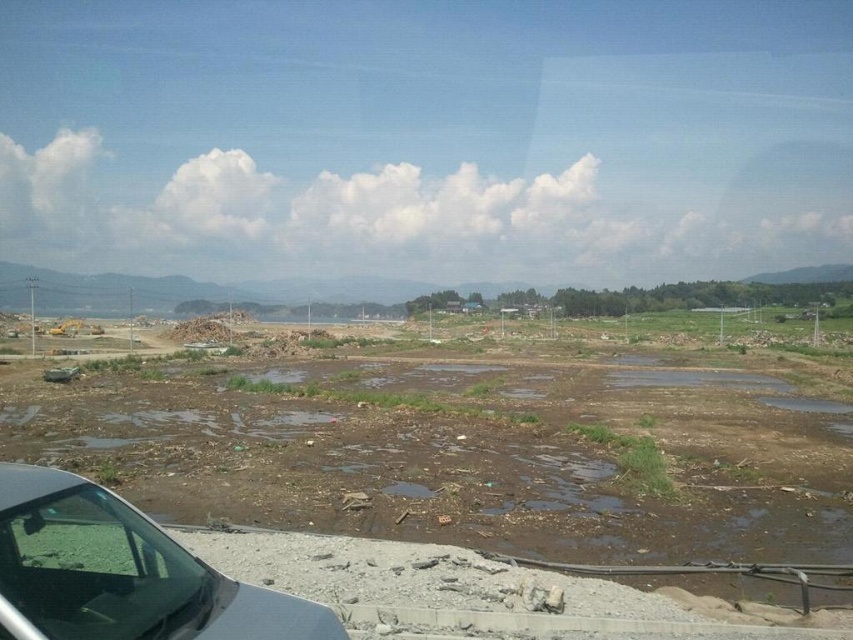
Does point (715, 460) come closer to viewer compared to point (177, 552)?

No, (715, 460) is behind (177, 552).

Is brown/dry soil at center below transparent glass car window at lower left?

Correct, brown/dry soil at center is located below transparent glass car window at lower left.

Describe the element at coordinates (451, 454) in the screenshot. I see `brown/dry soil at center` at that location.

Where is `brown/dry soil at center`? brown/dry soil at center is located at coordinates (451, 454).